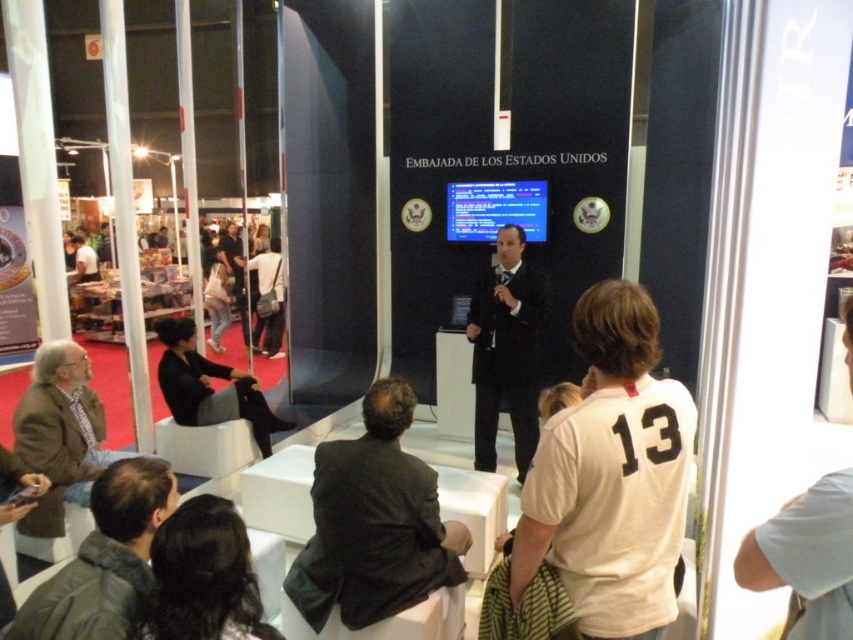
Question: Is black fabric jacket at lower left smaller than light brown leather jacket at left?

Choices:
 (A) no
 (B) yes

Answer: (B)

Question: Does dark brown hair at lower center appear on the left side of dark gray fabric bag at center?

Choices:
 (A) no
 (B) yes

Answer: (A)

Question: Which object is farther from the camera taking this photo?

Choices:
 (A) light brown leather jacket at left
 (B) dark green jacket at lower left
 (C) dark gray fabric bag at center

Answer: (A)

Question: Does dark green jacket at lower left appear under denim pants at center?

Choices:
 (A) no
 (B) yes

Answer: (B)

Question: Among these objects, which one is nearest to the camera?

Choices:
 (A) dark gray fabric bag at center
 (B) light brown leather jacket at left
 (C) black fabric jacket at lower left
 (D) dark green jacket at lower left

Answer: (D)

Question: Which point appears farthest from the camera in this image?

Choices:
 (A) (170, 371)
 (B) (374, 506)

Answer: (A)